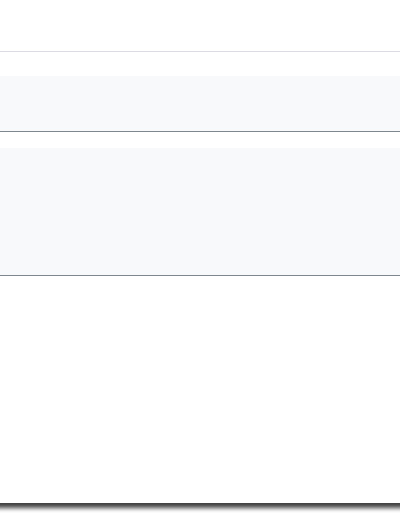
Locate an element on the screen. This screenshot has height=513, width=400. computer screen is located at coordinates (201, 32).